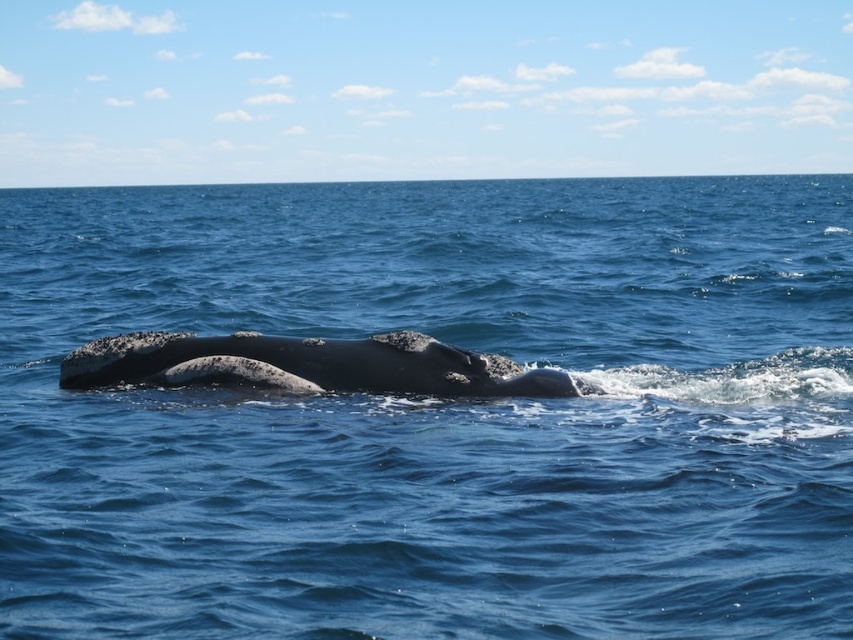
You are a marine biologist observing the ocean scene. You need to determine which object occupies more horizontal space in the image. Which one is wider between the glossy blue water at center and the smooth gray whale at center?

The glossy blue water at center is wider than the smooth gray whale at center according to the description.

You are standing on a boat and see a point in the ocean at coordinates point (292, 317). If you want to throw a lifebuoy to that point, and the lifebuoy can travel 50 feet, will it reach the point?

The distance of point (292, 317) from viewer is 60.79 feet, so the lifebuoy cannot reach the point as it requires traveling 60.79 feet which is beyond its 50 feet range.

You are a marine biologist observing the ocean scene. You notice the glossy blue water at center and the smooth gray whale at center. Which object appears taller in the image?

The glossy blue water at center has a greater height compared to the smooth gray whale at center, so the glossy blue water at center appears taller in the image.